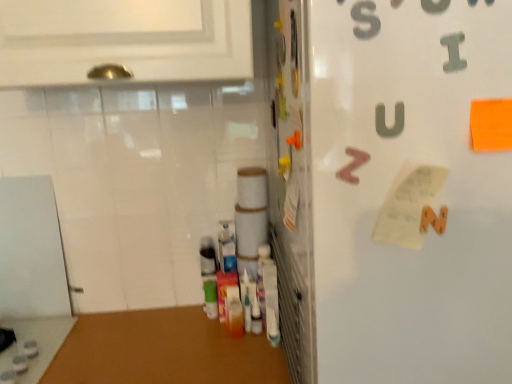
Question: Is metallic gray letter i at upper right, the first alphabet positioned from the front, taller than brown matte letter z at upper right, the first alphabet viewed from the left?

Choices:
 (A) yes
 (B) no

Answer: (B)

Question: Is metallic gray letter i at upper right, acting as the 2th alphabet starting from the back, to the left of brown matte letter z at upper right, the first alphabet viewed from the left, from the viewer's perspective?

Choices:
 (A) no
 (B) yes

Answer: (A)

Question: Is metallic gray letter i at upper right, the first alphabet positioned from the front, aimed at brown matte letter z at upper right, which ranks as the 2th alphabet in top-to-bottom order?

Choices:
 (A) no
 (B) yes

Answer: (A)

Question: Considering the relative sizes of metallic gray letter i at upper right, marked as the first alphabet in a right-to-left arrangement, and brown matte letter z at upper right, positioned as the second alphabet in right-to-left order, in the image provided, is metallic gray letter i at upper right, marked as the first alphabet in a right-to-left arrangement, smaller than brown matte letter z at upper right, positioned as the second alphabet in right-to-left order,?

Choices:
 (A) yes
 (B) no

Answer: (A)

Question: Is metallic gray letter i at upper right, arranged as the second alphabet when viewed from the left, not within brown matte letter z at upper right, which is the 1th alphabet in back-to-front order?

Choices:
 (A) yes
 (B) no

Answer: (A)

Question: Is brown matte letter z at upper right, positioned as the second alphabet in right-to-left order, wider or thinner than white matte refrigerator at right?

Choices:
 (A) thin
 (B) wide

Answer: (A)

Question: From a real-world perspective, relative to white matte refrigerator at right, is brown matte letter z at upper right, the first alphabet viewed from the left, vertically above or below?

Choices:
 (A) below
 (B) above

Answer: (B)

Question: In the image, is brown matte letter z at upper right, arranged as the first alphabet when ordered from the bottom, positioned in front of or behind white matte refrigerator at right?

Choices:
 (A) front
 (B) behind

Answer: (B)

Question: Is brown matte letter z at upper right, the first alphabet viewed from the left, bigger or smaller than white matte refrigerator at right?

Choices:
 (A) big
 (B) small

Answer: (B)

Question: Would you say metallic silver door at center is inside or outside metallic gray letter i at upper right, arranged as the second alphabet when viewed from the left?

Choices:
 (A) outside
 (B) inside

Answer: (A)

Question: From the image's perspective, is metallic silver door at center positioned above or below metallic gray letter i at upper right, the first alphabet positioned from the front?

Choices:
 (A) above
 (B) below

Answer: (B)

Question: Looking at the image, does metallic silver door at center seem bigger or smaller compared to metallic gray letter i at upper right, the first alphabet positioned from the front?

Choices:
 (A) big
 (B) small

Answer: (A)

Question: Looking at their shapes, would you say metallic silver door at center is wider or thinner than metallic gray letter i at upper right, arranged as the second alphabet when viewed from the left?

Choices:
 (A) thin
 (B) wide

Answer: (B)

Question: Would you say white matte refrigerator at right is inside or outside metallic gray letter i at upper right, the first alphabet positioned from the front?

Choices:
 (A) outside
 (B) inside

Answer: (A)

Question: From the image's perspective, relative to metallic gray letter i at upper right, the 2th alphabet when ordered from bottom to top, is white matte refrigerator at right above or below?

Choices:
 (A) below
 (B) above

Answer: (A)